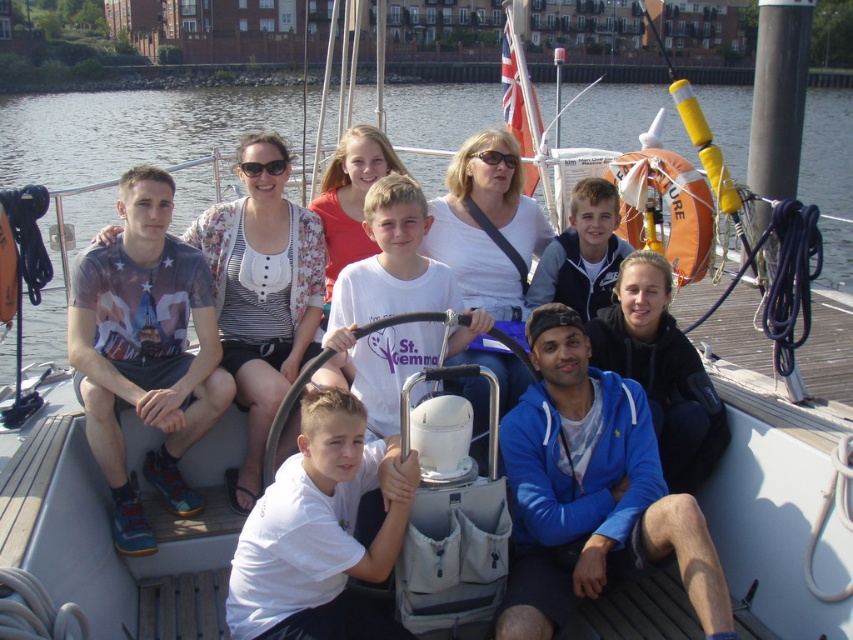
You are standing on the dock and looking at the two people on the boat. The blue fleece jacket at lower right and the white matte shirt at center are both visible. Which person is positioned higher relative to the other?

The blue fleece jacket at lower right is located above the white matte shirt at center, so the person wearing the blue fleece jacket at lower right is positioned higher.

You are standing on the deck of the sailboat and want to take a photo of two specific points marked as point 1 at position (550,307) and point 2 at position (210,320). Which point will appear larger in your photo?

Point 1 at position (550,307) will appear larger in the photo because it is closer to the camera than point 2 at position (210,320).